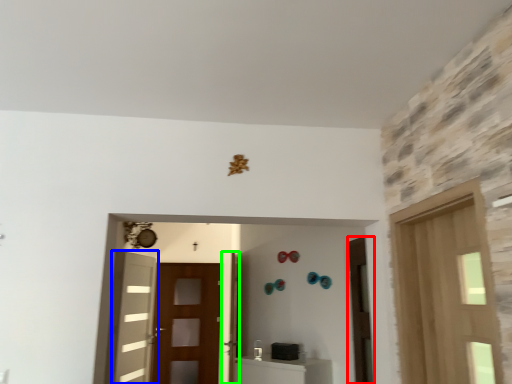
Question: Which is nearer to the door (highlighted by a red box)? door (highlighted by a blue box) or door (highlighted by a green box).

Choices:
 (A) door
 (B) door

Answer: (B)